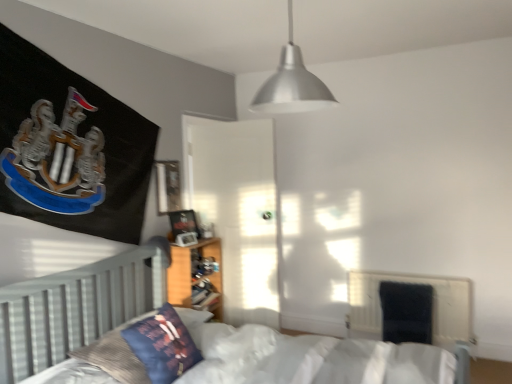
Based on the photo, measure the distance between point (190, 357) and camera.

The depth of point (190, 357) is 2.18 meters.

Measure the distance between point (x=288, y=108) and camera.

Point (x=288, y=108) is 10.70 feet from camera.

The height and width of the screenshot is (384, 512). Find the location of `wooden bookshelf at center`. wooden bookshelf at center is located at coordinates (192, 275).

Where is `black fabric radiator at lower right`? Image resolution: width=512 pixels, height=384 pixels. black fabric radiator at lower right is located at coordinates (410, 308).

This screenshot has width=512, height=384. What do you see at coordinates (410, 308) in the screenshot?
I see `black fabric radiator at lower right` at bounding box center [410, 308].

Describe the element at coordinates (406, 312) in the screenshot. The image size is (512, 384). I see `velvet dark blue armchair at lower right` at that location.

The height and width of the screenshot is (384, 512). I want to click on white wooden bed at center, so click(309, 358).

Which point is more distant from viewer, [431,341] or [201,357]?

Positioned behind is point [431,341].

Between velvet dark blue armchair at lower right and velvet blue pillow at lower left, which one appears on the left side from the viewer's perspective?

From the viewer's perspective, velvet blue pillow at lower left appears more on the left side.

In the image, is velvet dark blue armchair at lower right positioned in front of or behind velvet blue pillow at lower left?

Clearly, velvet dark blue armchair at lower right is behind velvet blue pillow at lower left.

In terms of size, does velvet dark blue armchair at lower right appear bigger or smaller than velvet blue pillow at lower left?

In the image, velvet dark blue armchair at lower right appears to be larger than velvet blue pillow at lower left.

Can you see wooden bookshelf at center touching black fabric radiator at lower right?

No, wooden bookshelf at center is not beside black fabric radiator at lower right.

Does wooden bookshelf at center have a lesser height compared to black fabric radiator at lower right?

No.

Is wooden bookshelf at center inside or outside of black fabric radiator at lower right?

wooden bookshelf at center is spatially situated outside black fabric radiator at lower right.

From the image's perspective, is wooden bookshelf at center on black fabric radiator at lower right?

Yes, from the image's perspective, wooden bookshelf at center is on top of black fabric radiator at lower right.

Which is closer, (438, 292) or (110, 358)?

Point (438, 292) appears to be farther away from the viewer than point (110, 358).

In the scene shown: Is black fabric radiator at lower right at the left side of white wooden bed at center?

Incorrect, black fabric radiator at lower right is not on the left side of white wooden bed at center.

Considering the relative sizes of black fabric radiator at lower right and white wooden bed at center in the image provided, is black fabric radiator at lower right wider than white wooden bed at center?

Incorrect, the width of black fabric radiator at lower right does not surpass that of white wooden bed at center.

Considering the positions of objects black fabric radiator at lower right and white wooden bed at center in the image provided, who is in front, black fabric radiator at lower right or white wooden bed at center?

Positioned in front is white wooden bed at center.

From a real-world perspective, is white wooden bed at center physically below velvet dark blue armchair at lower right?

No, from a real-world perspective, white wooden bed at center is not below velvet dark blue armchair at lower right.

Is white wooden bed at center inside the boundaries of velvet dark blue armchair at lower right, or outside?

white wooden bed at center is not enclosed by velvet dark blue armchair at lower right.

How different are the orientations of white wooden bed at center and velvet dark blue armchair at lower right in degrees?

88.5 degrees.

Does point (130, 363) come in front of point (426, 320)?

Yes, it is.

The height and width of the screenshot is (384, 512). Identify the location of bed on the right of velvet blue pillow at lower left. (309, 358).

In terms of size, does white wooden bed at center appear bigger or smaller than velvet blue pillow at lower left?

Clearly, white wooden bed at center is larger in size than velvet blue pillow at lower left.

Which object is wider, white wooden bed at center or velvet blue pillow at lower left?

white wooden bed at center.

Which object is more forward, white wooden bed at center or velvet blue pillow at lower left?

white wooden bed at center is closer to the camera.

From their relative heights in the image, would you say metallic silver pendant light at upper center is taller or shorter than velvet dark blue armchair at lower right?

Clearly, metallic silver pendant light at upper center is taller compared to velvet dark blue armchair at lower right.

Considering the relative sizes of metallic silver pendant light at upper center and velvet dark blue armchair at lower right in the image provided, is metallic silver pendant light at upper center thinner than velvet dark blue armchair at lower right?

In fact, metallic silver pendant light at upper center might be wider than velvet dark blue armchair at lower right.

Is the depth of velvet dark blue armchair at lower right greater than that of wooden bookshelf at center?

Yes.

Considering the points (396, 304) and (209, 277), which point is behind, point (396, 304) or point (209, 277)?

The point (396, 304) is more distant.

Find the location of `armchair located underneath the wooden bookshelf at center (from a real-world perspective)`. armchair located underneath the wooden bookshelf at center (from a real-world perspective) is located at coordinates (406, 312).

This screenshot has width=512, height=384. What are the coordinates of `armchair that appears below the velvet blue pillow at lower left (from the image's perspective)` in the screenshot? It's located at (x=406, y=312).

Identify the location of radiator behind the wooden bookshelf at center. The image size is (512, 384). (410, 308).

Based on the photo, from the image, which object appears to be nearer to white wooden bed at center, velvet dark blue armchair at lower right or metallic silver pendant light at upper center?

The object closer to white wooden bed at center is velvet dark blue armchair at lower right.

Based on their spatial positions, is velvet dark blue armchair at lower right or wooden bookshelf at center further from white wooden bed at center?

Among the two, velvet dark blue armchair at lower right is located further to white wooden bed at center.

In the scene shown: When comparing their distances from metallic silver pendant light at upper center, does black fabric radiator at lower right or velvet blue pillow at lower left seem further?

black fabric radiator at lower right is further to metallic silver pendant light at upper center.

Looking at the image, which one is located closer to metallic silver pendant light at upper center, velvet dark blue armchair at lower right or black fabric radiator at lower right?

Among the two, velvet dark blue armchair at lower right is located nearer to metallic silver pendant light at upper center.

Which object lies further to the anchor point velvet blue pillow at lower left, metallic silver pendant light at upper center or white wooden bed at center?

metallic silver pendant light at upper center.

From the image, which object appears to be nearer to black fabric radiator at lower right, metallic silver pendant light at upper center or velvet blue pillow at lower left?

metallic silver pendant light at upper center is closer to black fabric radiator at lower right.

Which object lies further to the anchor point velvet blue pillow at lower left, black fabric radiator at lower right or white wooden bed at center?

The object further to velvet blue pillow at lower left is black fabric radiator at lower right.

Looking at the image, which one is located closer to metallic silver pendant light at upper center, velvet blue pillow at lower left or wooden bookshelf at center?

wooden bookshelf at center.

I want to click on pillow between metallic silver pendant light at upper center and white wooden bed at center in the vertical direction, so click(x=162, y=345).

The image size is (512, 384). I want to click on pillow between white wooden bed at center and velvet dark blue armchair at lower right along the z-axis, so click(162, 345).

At what (x,y) coordinates should I click in order to perform the action: click on lamp located between white wooden bed at center and velvet dark blue armchair at lower right in the depth direction. Please return your answer as a coordinate pair (x, y). The width and height of the screenshot is (512, 384). Looking at the image, I should click on (292, 83).

At what (x,y) coordinates should I click in order to perform the action: click on armchair situated between wooden bookshelf at center and black fabric radiator at lower right from left to right. Please return your answer as a coordinate pair (x, y). The height and width of the screenshot is (384, 512). Looking at the image, I should click on (406, 312).